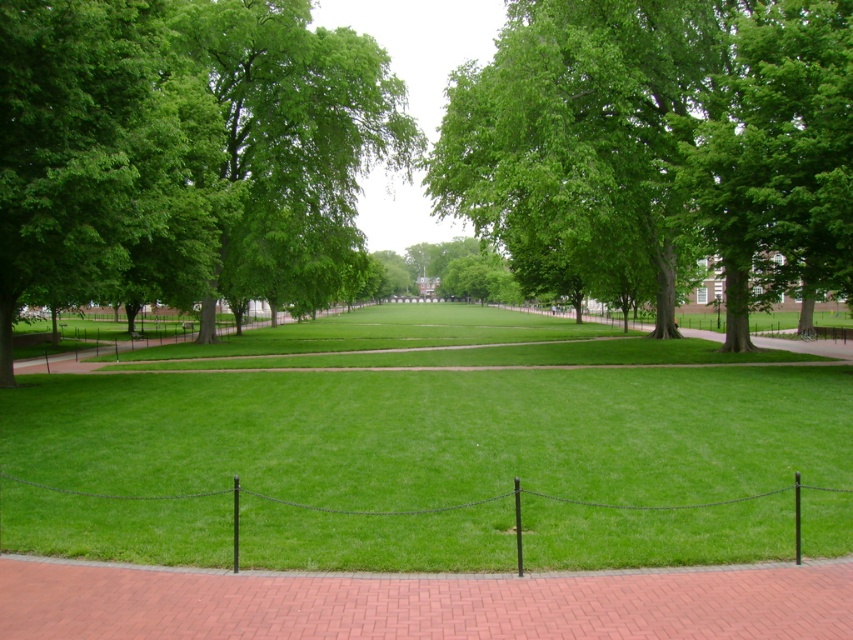
Question: Does green leafy tree at upper left have a smaller size compared to green leafy tree at center?

Choices:
 (A) no
 (B) yes

Answer: (A)

Question: Which point is closer to the camera?

Choices:
 (A) brick path at center
 (B) green leafy tree at upper left
 (C) green grass at center
 (D) green leafy tree at center

Answer: (A)

Question: From the image, what is the correct spatial relationship of green grass at center in relation to green leafy tree at center?

Choices:
 (A) left
 (B) right

Answer: (A)

Question: Is green leafy tree at upper left positioned behind brick path at center?

Choices:
 (A) no
 (B) yes

Answer: (B)

Question: Which object appears farthest from the camera in this image?

Choices:
 (A) brick path at center
 (B) green grass at center

Answer: (B)

Question: Which point is closer to the camera?

Choices:
 (A) green leafy tree at center
 (B) green grass at center
 (C) brick path at center
 (D) green leafy tree at upper left

Answer: (C)